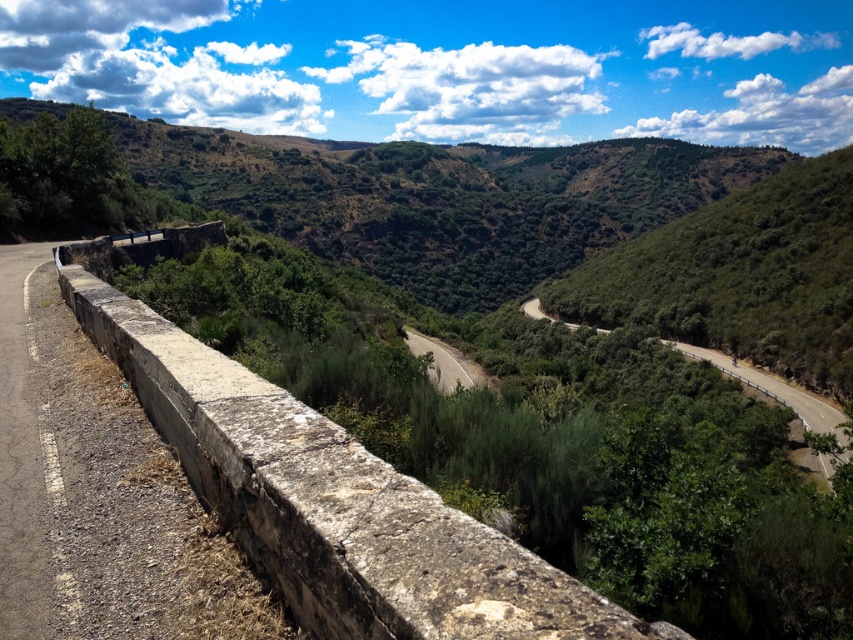
Question: Which object appears closest to the camera in this image?

Choices:
 (A) gray asphalt road at center
 (B) rusty concrete ledge at left
 (C) green grassy hill at upper center

Answer: (B)

Question: Does green grassy hill at upper center have a greater width compared to green leafy mountain at upper center?

Choices:
 (A) no
 (B) yes

Answer: (B)

Question: Which point is farther to the camera?

Choices:
 (A) (602, 225)
 (B) (416, 333)
 (C) (793, 20)

Answer: (C)

Question: Can you confirm if rusty concrete ledge at left is positioned to the left of green leafy mountain at upper center?

Choices:
 (A) no
 (B) yes

Answer: (B)

Question: Which point is farther to the camera?

Choices:
 (A) asphalt road at center
 (B) gray asphalt road at center
 (C) green grassy hill at upper center

Answer: (C)

Question: Is asphalt road at center smaller than gray asphalt road at center?

Choices:
 (A) no
 (B) yes

Answer: (A)